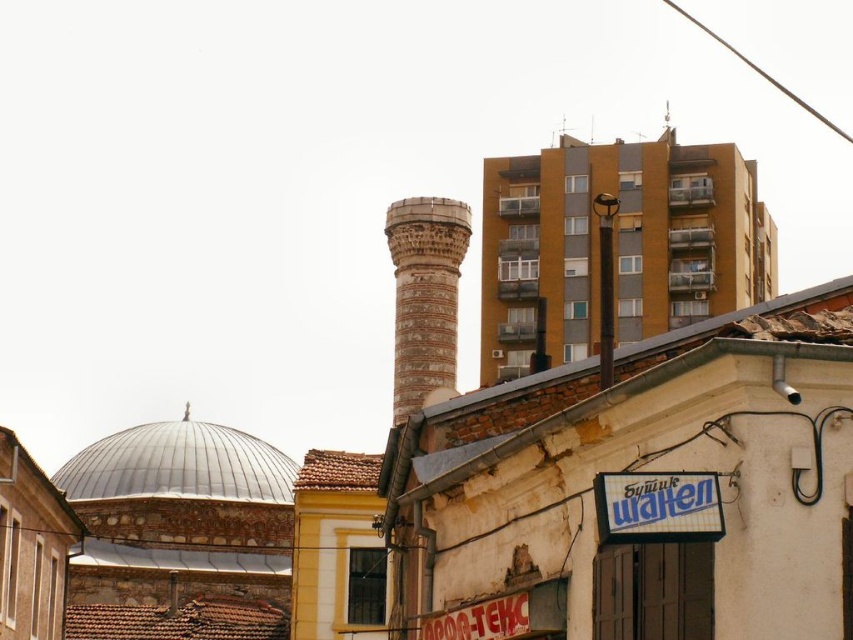
The width and height of the screenshot is (853, 640). Describe the element at coordinates (425, 296) in the screenshot. I see `brown stone tower at center` at that location.

Between brown stone tower at center and metallic wire at upper right, which one is positioned lower?

Positioned lower is brown stone tower at center.

Locate an element on the screen. Image resolution: width=853 pixels, height=640 pixels. brown stone tower at center is located at coordinates tap(425, 296).

Locate an element on the screen. This screenshot has height=640, width=853. brown stone tower at center is located at coordinates (425, 296).

Who is lower down, brown stone tower at center or white plastic sign at lower right?

white plastic sign at lower right

Does brown stone tower at center have a greater height compared to white plastic sign at lower right?

Indeed, brown stone tower at center has a greater height compared to white plastic sign at lower right.

Between point (434, 340) and point (720, 515), which one is positioned behind?

Positioned behind is point (434, 340).

What are the coordinates of `brown stone tower at center` in the screenshot? It's located at (425, 296).

How far apart are white plastic sign at lower right and metallic wire at upper right?

white plastic sign at lower right and metallic wire at upper right are 211.11 meters apart from each other.

Between white plastic sign at lower right and metallic wire at upper right, which one appears on the left side from the viewer's perspective?

white plastic sign at lower right is more to the left.

Does point (689, 515) lie in front of point (846, 138)?

Yes, point (689, 515) is in front of point (846, 138).

Where is `white plastic sign at lower right`? This screenshot has width=853, height=640. white plastic sign at lower right is located at coordinates (657, 506).